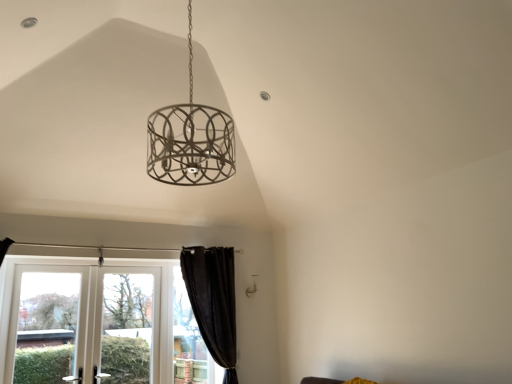
Where is `clear glass screen door at lower left`? clear glass screen door at lower left is located at coordinates (129, 326).

Image resolution: width=512 pixels, height=384 pixels. Describe the element at coordinates (129, 326) in the screenshot. I see `clear glass screen door at lower left` at that location.

Locate an element on the screen. The image size is (512, 384). black velvet curtain at lower left is located at coordinates (213, 301).

In order to face white plastic window at lower left, the second window when ordered from left to right, should I rotate leftwards or rightwards?

Turn left approximately 18.191 degrees to face it.

I want to click on black curtain at lower left, which is counted as the first window, starting from the right, so click(x=188, y=340).

From a real-world perspective, who is located higher, white plastic window at lower left, positioned as the second window in right-to-left order, or black velvet curtain at lower left?

From a 3D spatial view, black velvet curtain at lower left is above.

Is white plastic window at lower left, positioned as the second window in right-to-left order, at the left side of black velvet curtain at lower left?

Correct, you'll find white plastic window at lower left, positioned as the second window in right-to-left order, to the left of black velvet curtain at lower left.

Which object is thinner, white plastic window at lower left, the second window when ordered from left to right, or black velvet curtain at lower left?

white plastic window at lower left, the second window when ordered from left to right.

Which of these two, white plastic window at lower left, positioned as the second window in right-to-left order, or black velvet curtain at lower left, stands shorter?

Standing shorter between the two is white plastic window at lower left, positioned as the second window in right-to-left order.

Which is behind, clear glass screen door at lower left or black velvet curtain at lower left?

black velvet curtain at lower left is further from the camera.

In terms of width, does clear glass screen door at lower left look wider or thinner when compared to black velvet curtain at lower left?

clear glass screen door at lower left is thinner than black velvet curtain at lower left.

From a real-world perspective, which object rests below the other?

clear glass screen door at lower left is physically lower.

Is black velvet curtain at lower left completely or partially inside clear glass screen door at lower left?

Actually, black velvet curtain at lower left is outside clear glass screen door at lower left.

Measure the distance from white glass door at lower left, which is the first window in left-to-right order, to black curtain at lower left, acting as the 3th window starting from the left.

white glass door at lower left, which is the first window in left-to-right order, is 3.68 feet away from black curtain at lower left, acting as the 3th window starting from the left.

From the image's perspective, is white glass door at lower left, which is the first window in left-to-right order, located beneath black curtain at lower left, acting as the 3th window starting from the left?

Incorrect, from the image's perspective, white glass door at lower left, which is the first window in left-to-right order, is higher than black curtain at lower left, acting as the 3th window starting from the left.

Based on their sizes in the image, would you say white glass door at lower left, which is the first window in left-to-right order, is bigger or smaller than black curtain at lower left, which is counted as the first window, starting from the right?

white glass door at lower left, which is the first window in left-to-right order, is bigger than black curtain at lower left, which is counted as the first window, starting from the right.

Can you confirm if white glass door at lower left, which is the first window in left-to-right order, is wider than black curtain at lower left, acting as the 3th window starting from the left?

Yes, white glass door at lower left, which is the first window in left-to-right order, is wider than black curtain at lower left, acting as the 3th window starting from the left.

Identify the location of window above the black velvet curtain at lower left (from the image's perspective). (47, 326).

Considering the points (232, 251) and (70, 301), which point is behind, point (232, 251) or point (70, 301)?

The point (232, 251) is farther from the camera.

Who is smaller, black velvet curtain at lower left or white glass door at lower left, the 3th window when ordered from right to left?

With smaller size is white glass door at lower left, the 3th window when ordered from right to left.

Does black curtain at lower left, which is counted as the first window, starting from the right, contain white plastic window at lower left, the second window when ordered from left to right?

No, black curtain at lower left, which is counted as the first window, starting from the right, does not contain white plastic window at lower left, the second window when ordered from left to right.

Between black curtain at lower left, acting as the 3th window starting from the left, and white plastic window at lower left, positioned as the second window in right-to-left order, which one has larger width?

With larger width is white plastic window at lower left, positioned as the second window in right-to-left order.

Looking at this image, who is bigger, black curtain at lower left, which is counted as the first window, starting from the right, or white plastic window at lower left, positioned as the second window in right-to-left order?

With larger size is white plastic window at lower left, positioned as the second window in right-to-left order.

Does point (185, 344) lie in front of point (40, 337)?

No, (185, 344) is further to viewer.

Is point (193, 372) closer or farther from the camera than point (125, 333)?

Clearly, point (193, 372) is more distant from the camera than point (125, 333).

From the image's perspective, is black curtain at lower left, acting as the 3th window starting from the left, located above or below clear glass screen door at lower left?

From the image's perspective, black curtain at lower left, acting as the 3th window starting from the left, appears below clear glass screen door at lower left.

Considering the relative sizes of black curtain at lower left, acting as the 3th window starting from the left, and clear glass screen door at lower left in the image provided, is black curtain at lower left, acting as the 3th window starting from the left, thinner than clear glass screen door at lower left?

Correct, the width of black curtain at lower left, acting as the 3th window starting from the left, is less than that of clear glass screen door at lower left.

Considering the relative sizes of black curtain at lower left, acting as the 3th window starting from the left, and clear glass screen door at lower left in the image provided, is black curtain at lower left, acting as the 3th window starting from the left, bigger than clear glass screen door at lower left?

Incorrect, black curtain at lower left, acting as the 3th window starting from the left, is not larger than clear glass screen door at lower left.

Is black velvet curtain at lower left at the left side of black curtain at lower left, which is counted as the first window, starting from the right?

Incorrect, black velvet curtain at lower left is not on the left side of black curtain at lower left, which is counted as the first window, starting from the right.

How different are the orientations of black velvet curtain at lower left and black curtain at lower left, acting as the 3th window starting from the left, in degrees?

0.0877 degrees.

From a real-world perspective, between black velvet curtain at lower left and black curtain at lower left, which is counted as the first window, starting from the right, who is vertically higher?

black velvet curtain at lower left, from a real-world perspective.

Locate an element on the screen. window that is the 2nd one when counting forward from the black velvet curtain at lower left is located at coordinates (99, 324).

Locate an element on the screen. This screenshot has height=384, width=512. curtain on the right of the clear glass screen door at lower left is located at coordinates (213, 301).

From the image, which object appears to be nearer to white glass door at lower left, the 3th window when ordered from right to left, black velvet curtain at lower left or clear glass screen door at lower left?

The object closer to white glass door at lower left, the 3th window when ordered from right to left, is clear glass screen door at lower left.

When comparing their distances from white plastic window at lower left, the second window when ordered from left to right, does clear glass screen door at lower left or black curtain at lower left, acting as the 3th window starting from the left, seem further?

black curtain at lower left, acting as the 3th window starting from the left, is further to white plastic window at lower left, the second window when ordered from left to right.

Estimate the real-world distances between objects in this image. Which object is closer to clear glass screen door at lower left, black curtain at lower left, which is counted as the first window, starting from the right, or black velvet curtain at lower left?

Among the two, black curtain at lower left, which is counted as the first window, starting from the right, is located nearer to clear glass screen door at lower left.

Looking at the image, which one is located further to white plastic window at lower left, positioned as the second window in right-to-left order, black velvet curtain at lower left or clear glass screen door at lower left?

black velvet curtain at lower left is positioned further to the anchor white plastic window at lower left, positioned as the second window in right-to-left order.

Consider the image. Which object lies further to the anchor point white plastic window at lower left, the second window when ordered from left to right, white glass door at lower left, which is the first window in left-to-right order, or black curtain at lower left, acting as the 3th window starting from the left?

Among the two, black curtain at lower left, acting as the 3th window starting from the left, is located further to white plastic window at lower left, the second window when ordered from left to right.

Considering their positions, is clear glass screen door at lower left positioned closer to black velvet curtain at lower left than white glass door at lower left, which is the first window in left-to-right order?

Among the two, clear glass screen door at lower left is located nearer to black velvet curtain at lower left.

Considering their positions, is black curtain at lower left, acting as the 3th window starting from the left, positioned further to clear glass screen door at lower left than white glass door at lower left, which is the first window in left-to-right order?

white glass door at lower left, which is the first window in left-to-right order.

When comparing their distances from clear glass screen door at lower left, does white plastic window at lower left, positioned as the second window in right-to-left order, or black velvet curtain at lower left seem closer?

white plastic window at lower left, positioned as the second window in right-to-left order, is closer to clear glass screen door at lower left.

Find the location of a particular element. screen door between white plastic window at lower left, the second window when ordered from left to right, and black velvet curtain at lower left is located at coordinates (129, 326).

Identify the location of window between white glass door at lower left, the 3th window when ordered from right to left, and black curtain at lower left, which is counted as the first window, starting from the right, in the horizontal direction. (99, 324).

Locate an element on the screen. screen door between white glass door at lower left, the 3th window when ordered from right to left, and black velvet curtain at lower left from left to right is located at coordinates (129, 326).

The width and height of the screenshot is (512, 384). What are the coordinates of `screen door between white plastic window at lower left, the second window when ordered from left to right, and black curtain at lower left, which is counted as the first window, starting from the right, in the front-back direction` in the screenshot? It's located at (129, 326).